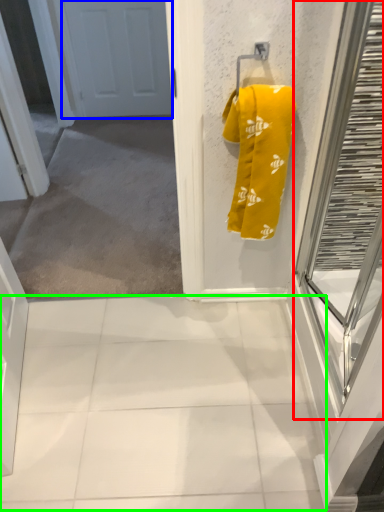
Question: Estimate the real-world distances between objects in this image. Which object is farther from glass door (highlighted by a red box), door (highlighted by a blue box) or tile (highlighted by a green box)?

Choices:
 (A) door
 (B) tile

Answer: (A)